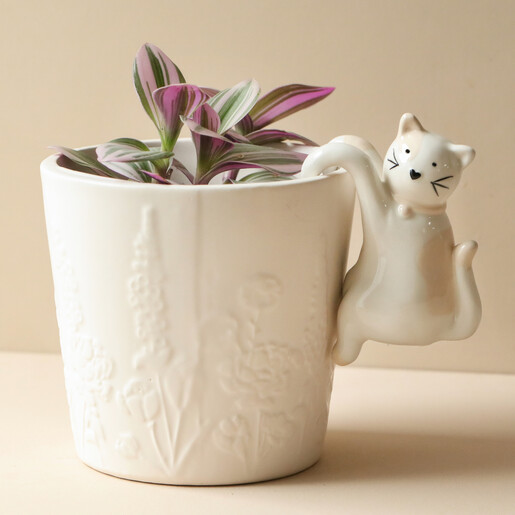
In order to click on cat decoration in this screenshot , I will do `click(426, 223)`.